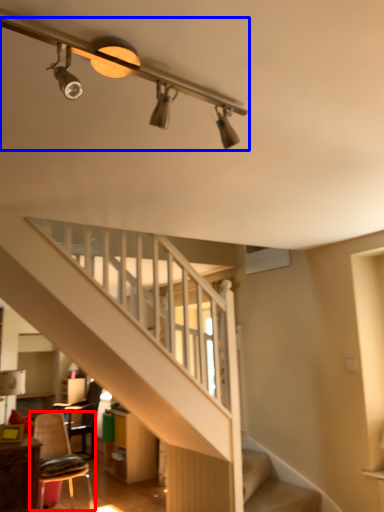
Question: Which object appears farthest to the camera in this image, chair (highlighted by a red box) or light fixture (highlighted by a blue box)?

Choices:
 (A) chair
 (B) light fixture

Answer: (A)